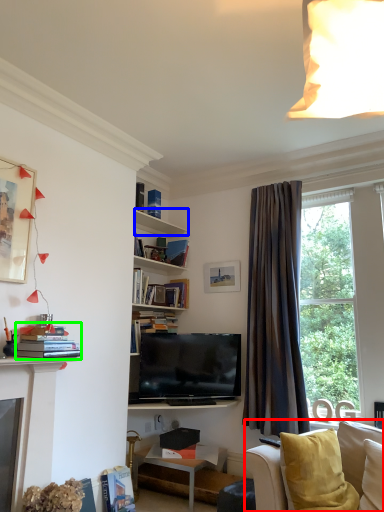
Question: Which object is the closest to the studio couch (highlighted by a red box)? Choose among these: shelf (highlighted by a blue box) or book (highlighted by a green box).

Choices:
 (A) shelf
 (B) book

Answer: (B)